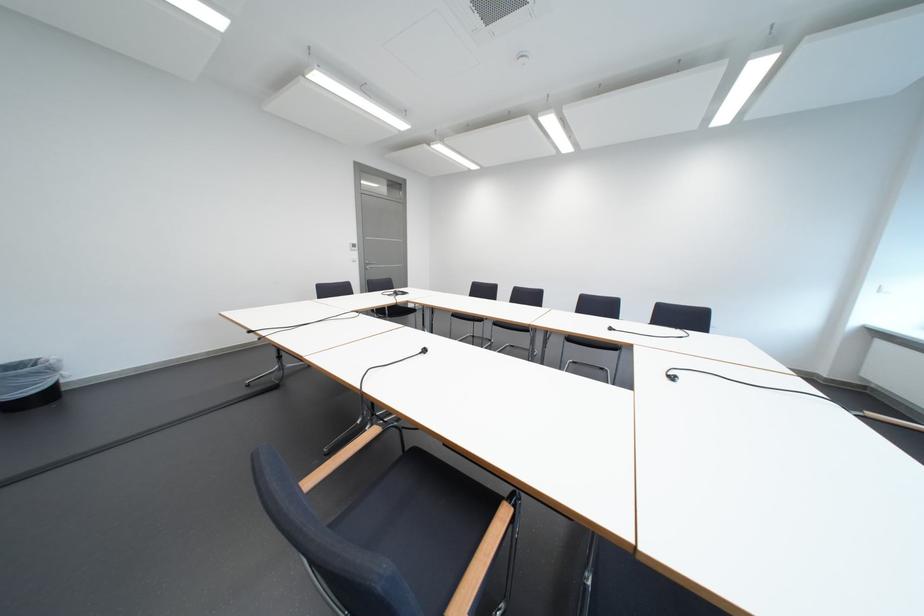
The image size is (924, 616). What do you see at coordinates (423, 517) in the screenshot?
I see `the blue chair sitting surface` at bounding box center [423, 517].